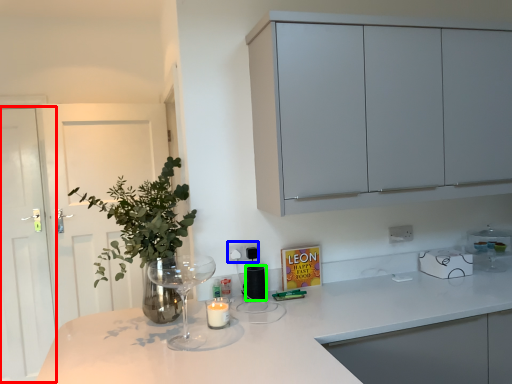
Question: Which object is the closest to the glass door (highlighted by a red box)? Choose among these: electric outlet (highlighted by a blue box) or appliance (highlighted by a green box).

Choices:
 (A) electric outlet
 (B) appliance

Answer: (A)